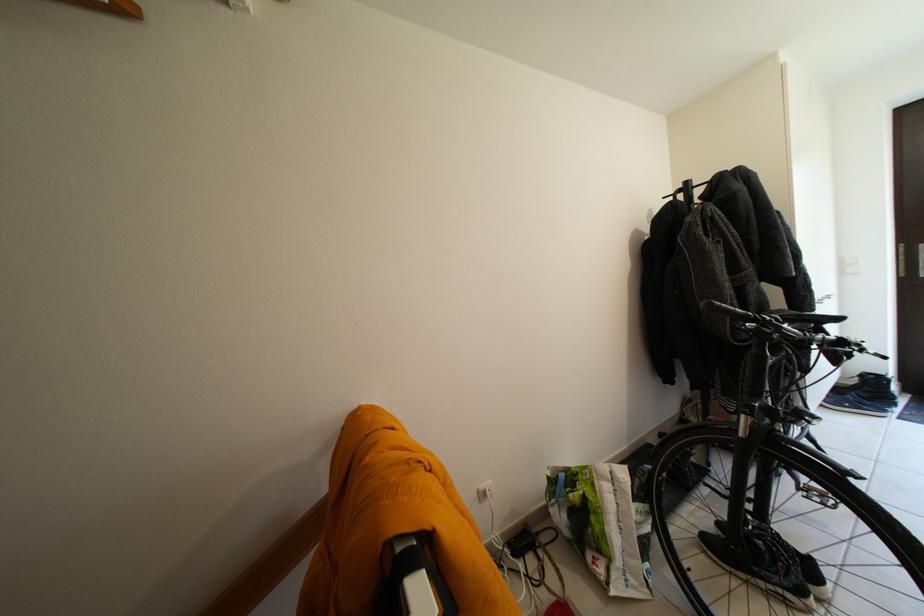
Find where to push the silver door handle. Please return your answer as a coordinate pair (x, y).

(901, 259)